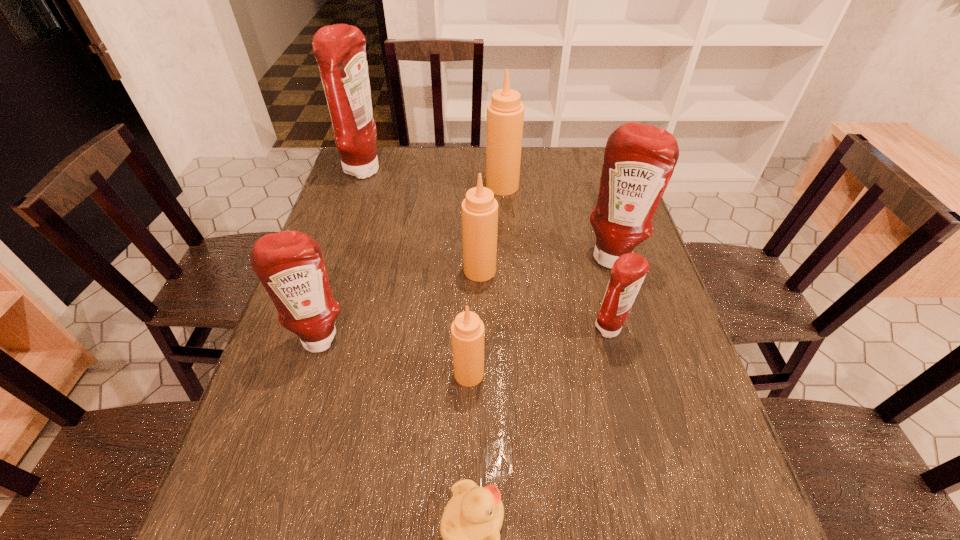
Find the location of `vacant position at the far right corner of the desktop`. vacant position at the far right corner of the desktop is located at coordinates (584, 170).

At what (x,y) coordinates should I click in order to perform the action: click on vacant space at the near right corner of the desktop. Please return your answer as a coordinate pair (x, y). Looking at the image, I should click on (680, 539).

Where is `empty space between the second smallest red condiment and the biggest tan condiment`? empty space between the second smallest red condiment and the biggest tan condiment is located at coordinates (x=411, y=262).

Where is `vacant area between the second biggest red condiment and the second farthest tan condiment`? The height and width of the screenshot is (540, 960). vacant area between the second biggest red condiment and the second farthest tan condiment is located at coordinates (545, 262).

This screenshot has width=960, height=540. Find the location of `free space between the seventh farthest object and the smallest red condiment`. free space between the seventh farthest object and the smallest red condiment is located at coordinates (540, 352).

At what (x,y) coordinates should I click in order to perform the action: click on empty space between the second biggest red condiment and the second biggest tan condiment. Please return your answer as a coordinate pair (x, y). This screenshot has height=540, width=960. Looking at the image, I should click on (545, 262).

Where is `free space between the smallest red condiment and the nearest condiment`? This screenshot has width=960, height=540. free space between the smallest red condiment and the nearest condiment is located at coordinates (540, 352).

At what (x,y) coordinates should I click in order to perform the action: click on vacant region between the second smallest red condiment and the biggest tan condiment. Please return your answer as a coordinate pair (x, y). Image resolution: width=960 pixels, height=540 pixels. Looking at the image, I should click on (411, 262).

Locate an element on the screen. the fifth closest object to the biggest red condiment is located at coordinates 467,330.

Find the location of a particular element. The image size is (960, 540). the fourth closest object to the nearest tan condiment is located at coordinates (628, 272).